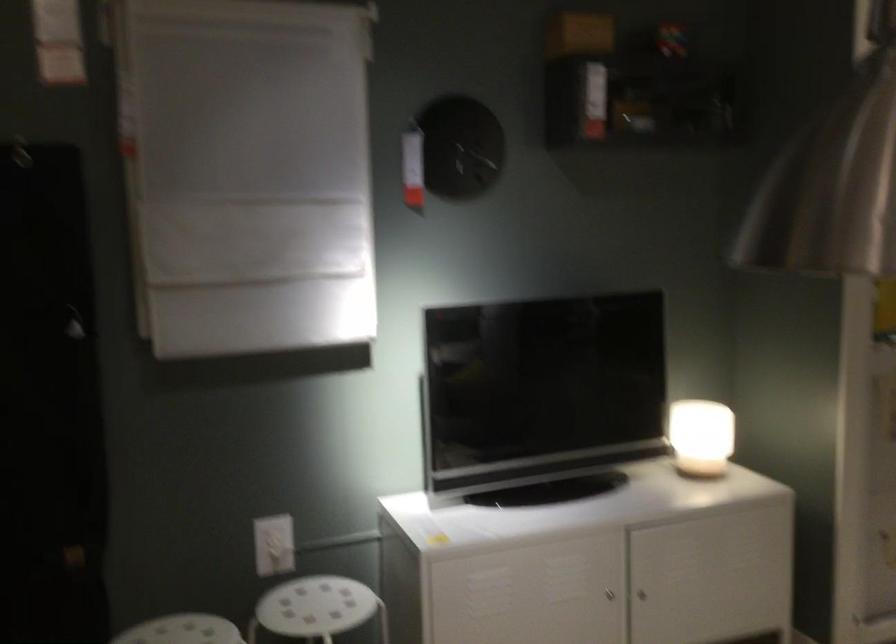
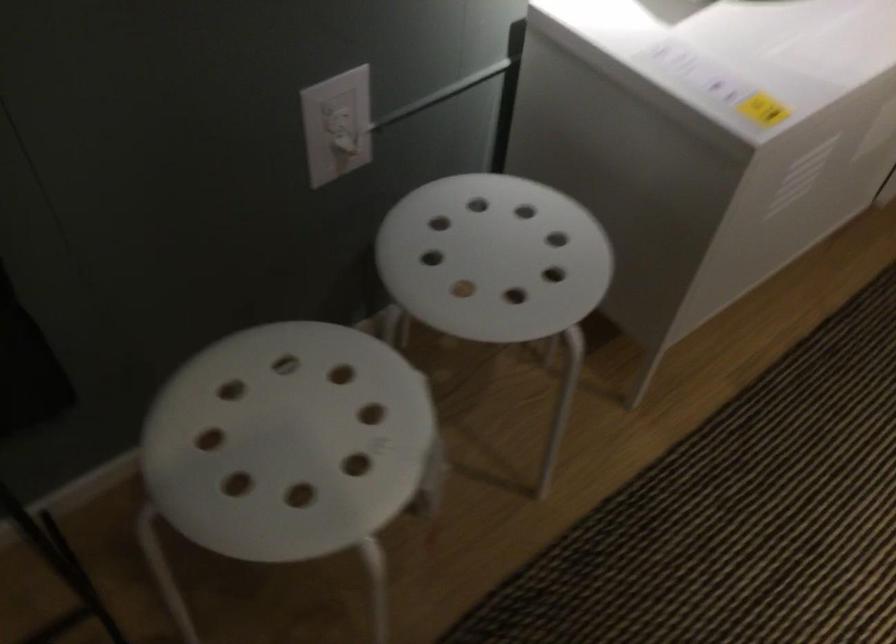
In the second image, find the point that corresponds to pixel 277 545 in the first image.

(337, 125)